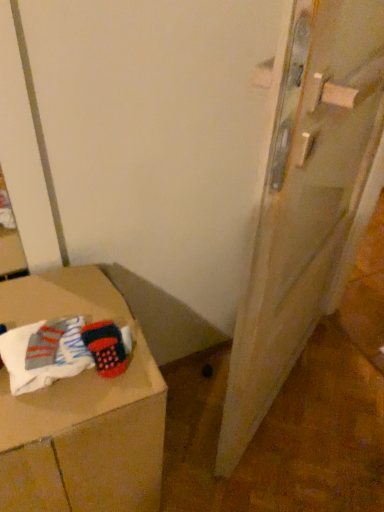
Question: Is white cotton socks at lower left smaller than wooden door at right?

Choices:
 (A) yes
 (B) no

Answer: (A)

Question: Is white cotton socks at lower left in front of wooden door at right?

Choices:
 (A) yes
 (B) no

Answer: (B)

Question: Is white cotton socks at lower left taller than wooden door at right?

Choices:
 (A) yes
 (B) no

Answer: (B)

Question: From the image's perspective, is white cotton socks at lower left above wooden door at right?

Choices:
 (A) yes
 (B) no

Answer: (B)

Question: Does white cotton socks at lower left have a greater width compared to wooden door at right?

Choices:
 (A) no
 (B) yes

Answer: (A)

Question: Is white cotton socks at lower left located outside wooden door at right?

Choices:
 (A) yes
 (B) no

Answer: (A)

Question: Is cardboard box at lower left facing towards white cotton socks at lower left?

Choices:
 (A) yes
 (B) no

Answer: (B)

Question: Can you confirm if cardboard box at lower left is taller than white cotton socks at lower left?

Choices:
 (A) no
 (B) yes

Answer: (B)

Question: Does cardboard box at lower left appear on the right side of white cotton socks at lower left?

Choices:
 (A) no
 (B) yes

Answer: (A)

Question: From the image's perspective, is cardboard box at lower left below white cotton socks at lower left?

Choices:
 (A) yes
 (B) no

Answer: (A)

Question: Is cardboard box at lower left outside of white cotton socks at lower left?

Choices:
 (A) no
 (B) yes

Answer: (B)

Question: Can you confirm if cardboard box at lower left is positioned to the left of white cotton socks at lower left?

Choices:
 (A) yes
 (B) no

Answer: (A)

Question: Is wooden door at right facing towards cardboard box at lower left?

Choices:
 (A) yes
 (B) no

Answer: (B)